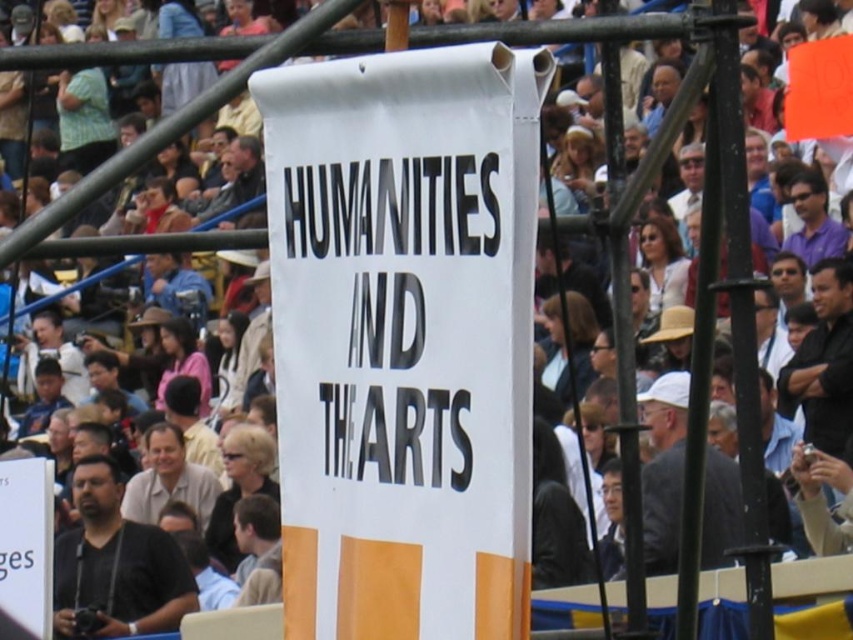
You are a photographer at the event and want to take a clear picture of the white banner with the bold black text. You have a matte black camera at lower left and a black leather jacket at right. Which object is closer to you, the photographer, so you can adjust your position accordingly?

The matte black camera at lower left is closer to you than the black leather jacket at right, so you should move slightly to avoid the camera obstructing your view of the banner.

You are organizing a photography session and want to capture both the white paper banner at center and the dark gray suit at center in the same frame. Which object should you adjust your camera focus on first to ensure both are in the frame?

The white paper banner at center has a smaller width than the dark gray suit at center, so you should focus on the wider dark gray suit at center first to ensure both fit within the frame.